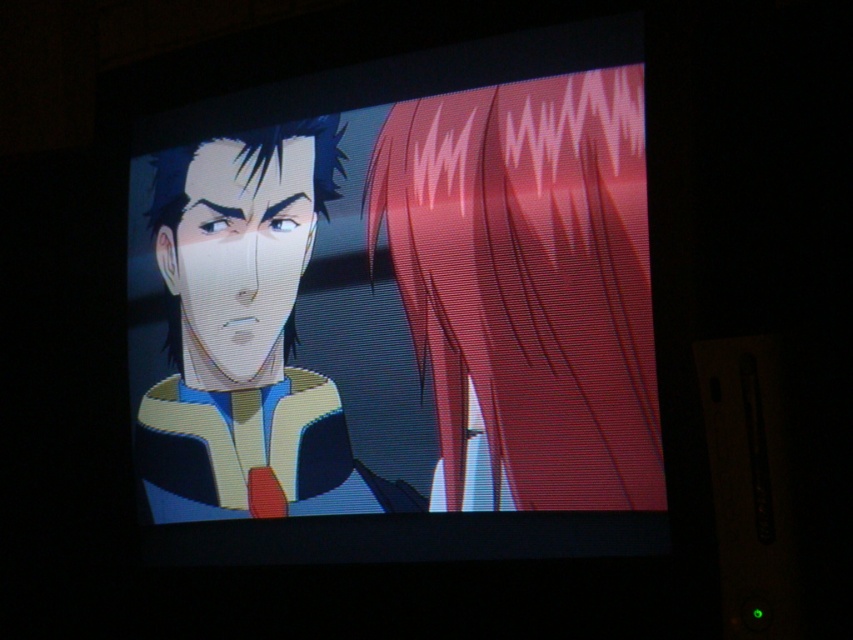
Question: Which point is farther from the camera taking this photo?

Choices:
 (A) (175, 243)
 (B) (502, 392)

Answer: (A)

Question: Is matte black monitor at center smaller than matte yellow jacket at left?

Choices:
 (A) no
 (B) yes

Answer: (A)

Question: Is matte black monitor at center to the right of matte yellow jacket at left from the viewer's perspective?

Choices:
 (A) no
 (B) yes

Answer: (B)

Question: Is matte black monitor at center to the left of matte yellow jacket at left from the viewer's perspective?

Choices:
 (A) no
 (B) yes

Answer: (A)

Question: Among these objects, which one is farthest from the camera?

Choices:
 (A) matte black monitor at center
 (B) matte yellow jacket at left

Answer: (B)